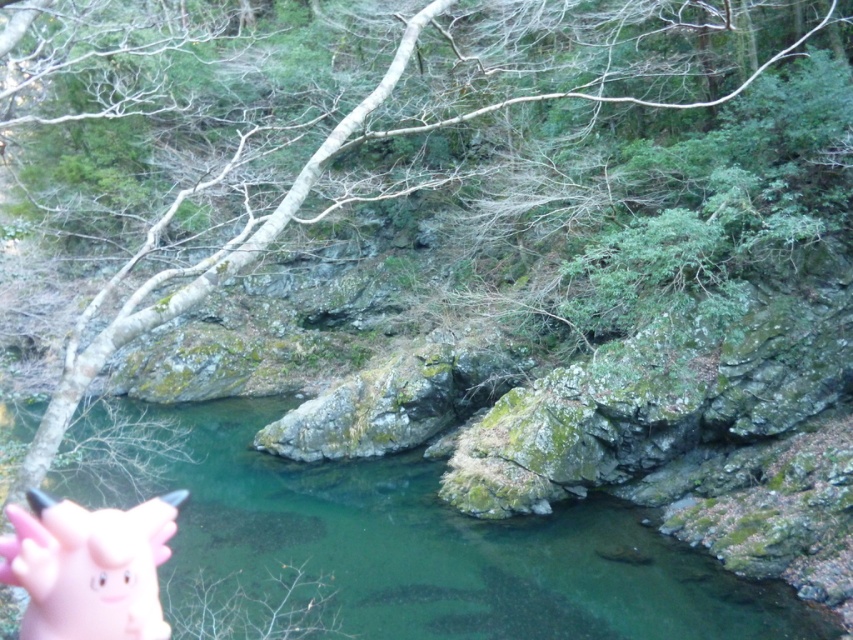
You are a hiker who wants to place a small item in your backpack. You see the green mossy rock at center and the pink rubber piggy bank at bottom left. Which one can you fit into your backpack?

The pink rubber piggy bank at bottom left can fit into your backpack because it is smaller than the green mossy rock at center.

You are a photographer aiming to capture a clear photo of the pink rubber piggy bank at bottom left without the green mossy rock at center blocking it. What should you do?

Move the camera to the side so that the pink rubber piggy bank at bottom left is no longer behind the green mossy rock at center. Since the pink rubber piggy bank at bottom left is currently behind the green mossy rock at center, adjusting the camera angle or position will allow you to see it clearly without obstruction.